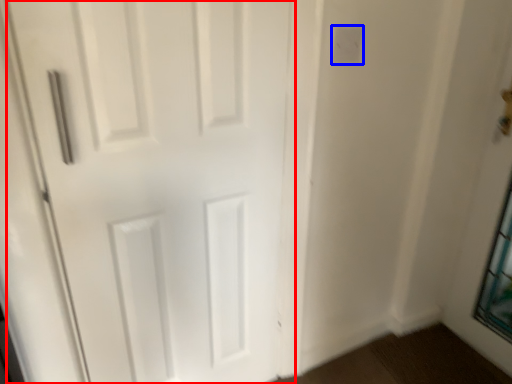
Question: Which point is closer to the camera, door (highlighted by a red box) or electric outlet (highlighted by a blue box)?

Choices:
 (A) door
 (B) electric outlet

Answer: (A)